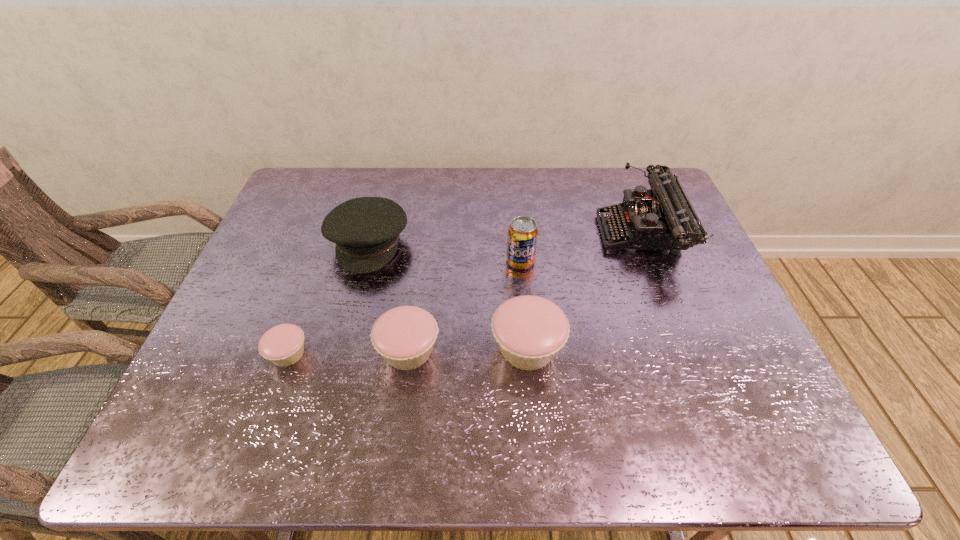
Locate an element on the screen. The height and width of the screenshot is (540, 960). free space that is in between the second shortest cupcake and the beret is located at coordinates (389, 297).

You are a GUI agent. You are given a task and a screenshot of the screen. Output one action in this format:
    pyautogui.click(x=<x>, y=<y>)
    Task: Click on the vacant area that lies between the rightmost cupcake and the fifth tallest object
    This screenshot has width=960, height=540.
    Given the screenshot: What is the action you would take?
    pyautogui.click(x=468, y=349)

Locate an element on the screen. This screenshot has width=960, height=540. blank region between the beret and the second shortest cupcake is located at coordinates (389, 297).

Where is `empty location between the second shortest object and the rightmost object`? This screenshot has height=540, width=960. empty location between the second shortest object and the rightmost object is located at coordinates (525, 293).

Select which object appears as the fourth closest to the typewriter. Please provide its 2D coordinates. Your answer should be formatted as a tuple, i.e. [(x, y)], where the tuple contains the x and y coordinates of a point satisfying the conditions above.

[(366, 230)]

Find the location of a particular element. This screenshot has height=540, width=960. the second closest object to the beret is located at coordinates (283, 345).

Choose which cupcake is the second nearest neighbor to the beret. Please provide its 2D coordinates. Your answer should be formatted as a tuple, i.e. [(x, y)], where the tuple contains the x and y coordinates of a point satisfying the conditions above.

[(283, 345)]

Point out which cupcake is positioned as the nearest to the second cupcake from right to left. Please provide its 2D coordinates. Your answer should be formatted as a tuple, i.e. [(x, y)], where the tuple contains the x and y coordinates of a point satisfying the conditions above.

[(530, 330)]

Where is `vacant space that satisfies the following two spatial constraints: 1. on the back side of the soda can; 2. on the right side of the shortest object`? The width and height of the screenshot is (960, 540). vacant space that satisfies the following two spatial constraints: 1. on the back side of the soda can; 2. on the right side of the shortest object is located at coordinates (322, 261).

I want to click on free spot that satisfies the following two spatial constraints: 1. on the keyboard of the typewriter; 2. on the front side of the second cupcake from right to left, so click(x=686, y=350).